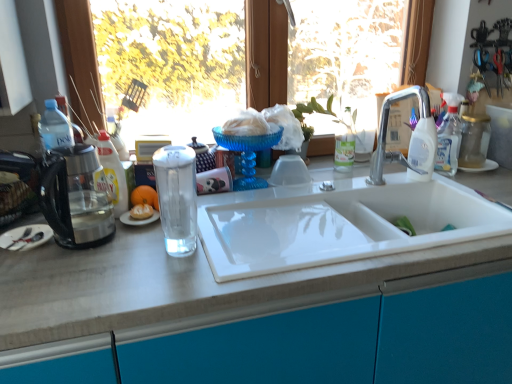
In order to face translucent glass kettle at left, should I rotate leftwards or rightwards?

You should rotate left by 22.684 degrees.

What do you see at coordinates (76, 197) in the screenshot?
I see `translucent glass kettle at left` at bounding box center [76, 197].

Measure the distance between transparent glass window at upper center and camera.

transparent glass window at upper center is 5.13 feet from camera.

At what (x,y) coordinates should I click in order to perform the action: click on transparent glass window at upper center. Please return your answer as a coordinate pair (x, y). This screenshot has height=384, width=512. Looking at the image, I should click on (266, 53).

What do you see at coordinates (145, 196) in the screenshot?
I see `orange matte at center` at bounding box center [145, 196].

You are a GUI agent. You are given a task and a screenshot of the screen. Output one action in this format:
    pyautogui.click(x=<x>, y=<y>)
    Task: Click on the white matte countertop at center
    The image size is (512, 384).
    Given the screenshot: What is the action you would take?
    pyautogui.click(x=173, y=283)

What do you see at coordinates (412, 138) in the screenshot?
I see `silver metallic faucet at upper right` at bounding box center [412, 138].

Locate an element on the screen. The height and width of the screenshot is (384, 512). translucent glass kettle at left is located at coordinates (76, 197).

Looking at this image, choose the correct answer: Is orange matte at center inside translucent glass kettle at left or outside it?

The correct answer is: outside.

Which object is positioned more to the left, orange matte at center or translucent glass kettle at left?

translucent glass kettle at left is more to the left.

Considering the points (149, 191) and (72, 230), which point is in front, point (149, 191) or point (72, 230)?

The point (72, 230) is closer to the camera.

Is orange matte at center further to the viewer compared to translucent glass kettle at left?

Yes, orange matte at center is behind translucent glass kettle at left.

From the picture: Can you tell me how much transparent glass window at upper center and clear glass bottle at left differ in facing direction?

The angle between the facing direction of transparent glass window at upper center and the facing direction of clear glass bottle at left is 21.4 degrees.

Is transparent glass window at upper center inside the boundaries of clear glass bottle at left, or outside?

transparent glass window at upper center is not inside clear glass bottle at left, it's outside.

Which point is more distant from viewer, (420,9) or (128,199)?

The point (420,9) is behind.

From the image's perspective, is transparent glass window at upper center over clear glass bottle at left?

Correct, transparent glass window at upper center appears higher than clear glass bottle at left in the image.

From the image's perspective, is white matte plate at left above or below white glossy bottle at upper right?

white matte plate at left is situated lower than white glossy bottle at upper right in the image.

Is white matte plate at left taller or shorter than white glossy bottle at upper right?

Clearly, white matte plate at left is shorter compared to white glossy bottle at upper right.

Where is `plate on the left of white glossy bottle at upper right`? This screenshot has width=512, height=384. plate on the left of white glossy bottle at upper right is located at coordinates (25, 237).

Which of these two, white matte plate at left or white glossy bottle at upper right, is bigger?

white glossy bottle at upper right is bigger.

Between white matte countertop at center and silver metallic faucet at upper right, which one appears on the right side from the viewer's perspective?

silver metallic faucet at upper right.

Is point (115, 290) behind point (429, 176)?

No, it is in front of (429, 176).

In the image, there is a silver metallic faucet at upper right. Identify the location of countertop below it (from the image's perspective). (173, 283).

From a real-world perspective, which object stands above the other?

silver metallic faucet at upper right, from a real-world perspective.

Identify the location of food beneath the orange matte at center (from a real-world perspective). This screenshot has height=384, width=512. (141, 212).

Can you confirm if white fluffy food at center is smaller than orange matte at center?

Yes, white fluffy food at center is smaller than orange matte at center.

From a real-world perspective, between white fluffy food at center and orange matte at center, who is vertically higher?

orange matte at center, from a real-world perspective.

Does white fluffy food at center have a greater height compared to orange matte at center?

In fact, white fluffy food at center may be shorter than orange matte at center.

Considering the sizes of objects white matte countertop at center and orange matte at center in the image provided, who is shorter, white matte countertop at center or orange matte at center?

orange matte at center.

Considering the sizes of white matte countertop at center and orange matte at center in the image, is white matte countertop at center bigger or smaller than orange matte at center?

In the image, white matte countertop at center appears to be larger than orange matte at center.

Can you confirm if white matte countertop at center is positioned to the right of orange matte at center?

Indeed, white matte countertop at center is positioned on the right side of orange matte at center.

Consider the image. Is translucent glass kettle at left not inside silver metallic faucet at upper right?

Yes, translucent glass kettle at left is not within silver metallic faucet at upper right.

Identify the location of tap behind the translucent glass kettle at left. (412, 138).

From a real-world perspective, is translucent glass kettle at left below silver metallic faucet at upper right?

Yes, from a real-world perspective, translucent glass kettle at left is beneath silver metallic faucet at upper right.

The height and width of the screenshot is (384, 512). In the image, there is a orange matte at center. Find the location of `appliance above it (from the image's perspective)`. appliance above it (from the image's perspective) is located at coordinates (76, 197).

Where is `bottle lying on the left of transparent glass window at upper center`? The height and width of the screenshot is (384, 512). bottle lying on the left of transparent glass window at upper center is located at coordinates (113, 173).

From the image, which object appears to be nearer to clear glass water at center, white fluffy food at center or silver metallic faucet at upper right?

white fluffy food at center lies closer to clear glass water at center than the other object.

When comparing their distances from orange matte at center, does white matte plate at left or white fluffy food at center seem further?

white matte plate at left is further to orange matte at center.

Which object lies nearer to the anchor point translucent glass kettle at left, orange matte at center or transparent glass window at upper center?

orange matte at center lies closer to translucent glass kettle at left than the other object.

Looking at the image, which one is located further to translucent glass kettle at left, white matte countertop at center or clear glass water at center?

clear glass water at center.

Based on their spatial positions, is clear glass water at center or white matte plate at left closer to white glossy bottle at upper right?

clear glass water at center is closer to white glossy bottle at upper right.

Looking at this image, from the image, which object appears to be nearer to white fluffy food at center, white matte plate at left or orange matte at center?

orange matte at center is closer to white fluffy food at center.

Based on their spatial positions, is white matte countertop at center or translucent glass kettle at left closer to transparent glass window at upper center?

translucent glass kettle at left.

Estimate the real-world distances between objects in this image. Which object is further from clear glass water at center, white fluffy food at center or clear glass bottle at left?

Based on the image, clear glass bottle at left appears to be further to clear glass water at center.

Find the location of a particular element. beverage between clear glass bottle at left and white glossy bottle at upper right from left to right is located at coordinates (177, 198).

Find the location of a particular element. bottle between white matte plate at left and clear glass water at center from left to right is located at coordinates (113, 173).

Locate an element on the screen. bottle situated between white matte plate at left and white fluffy food at center from left to right is located at coordinates (113, 173).

Find the location of a particular element. This screenshot has width=512, height=384. food between transparent glass window at upper center and white matte countertop at center in the up-down direction is located at coordinates (141, 212).